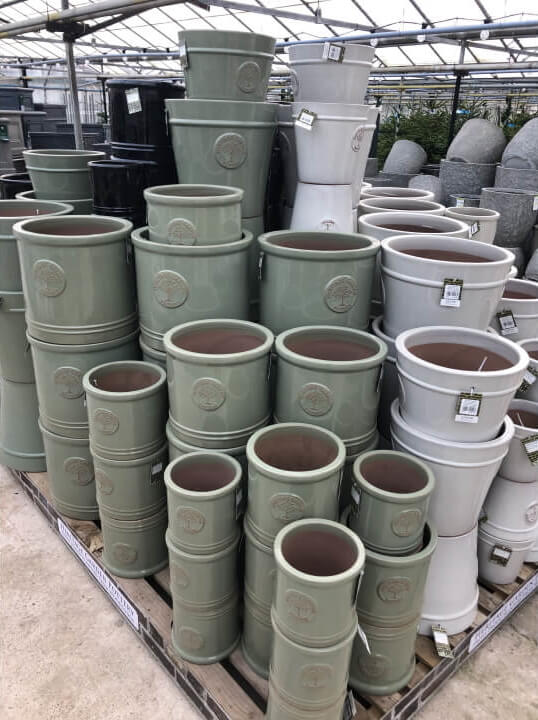
Identify the location of white pot. The height and width of the screenshot is (720, 538). tap(329, 140).